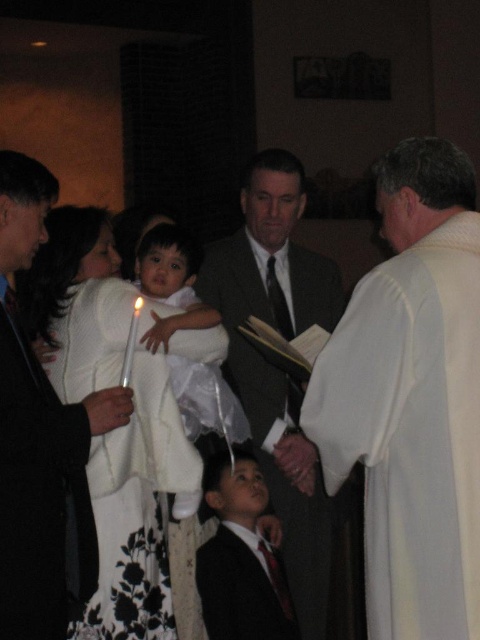
Question: Does smooth white robe at center have a larger size compared to white satin baby at center?

Choices:
 (A) no
 (B) yes

Answer: (A)

Question: Can you confirm if white cloth at right is smaller than white satin baby at center?

Choices:
 (A) no
 (B) yes

Answer: (A)

Question: Which of these objects is positioned closest to the white satin dress at center?

Choices:
 (A) white cloth at right
 (B) white wax candle at center
 (C) white satin baby at center
 (D) white cotton suit at center

Answer: (D)

Question: Which of the following is the closest to the observer?

Choices:
 (A) (x=166, y=486)
 (B) (x=82, y=429)
 (C) (x=479, y=260)

Answer: (C)

Question: Which point is farther to the camera?

Choices:
 (A) white satin dress at center
 (B) white cloth at right
 (C) smooth white robe at center
 (D) dark suit at center

Answer: (D)

Question: Is white cloth at right to the left of white wax candle at center from the viewer's perspective?

Choices:
 (A) no
 (B) yes

Answer: (A)